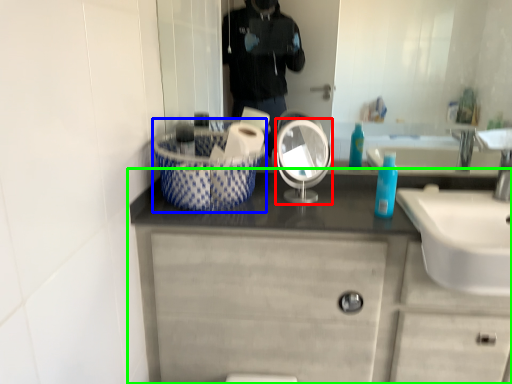
Question: Which is farther away from mirror (highlighted by a red box)? basket (highlighted by a blue box) or bathroom cabinet (highlighted by a green box)?

Choices:
 (A) basket
 (B) bathroom cabinet

Answer: (B)